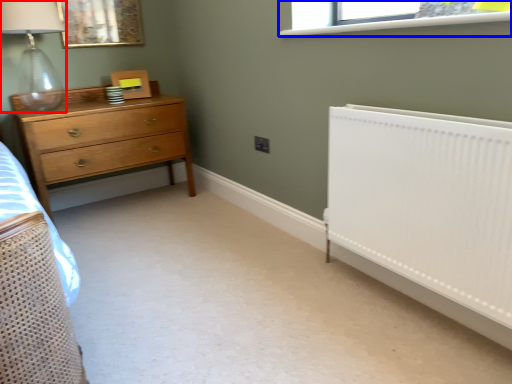
Question: Among these objects, which one is nearest to the camera, lamp (highlighted by a red box) or window (highlighted by a blue box)?

Choices:
 (A) lamp
 (B) window

Answer: (B)